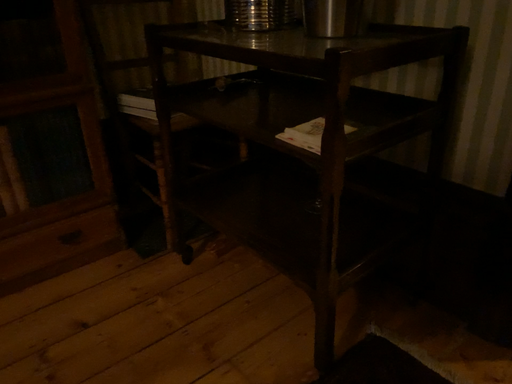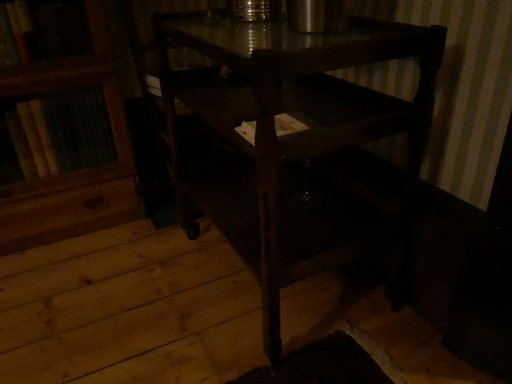
Question: Which way did the camera rotate in the video?

Choices:
 (A) rotated right
 (B) rotated left

Answer: (B)